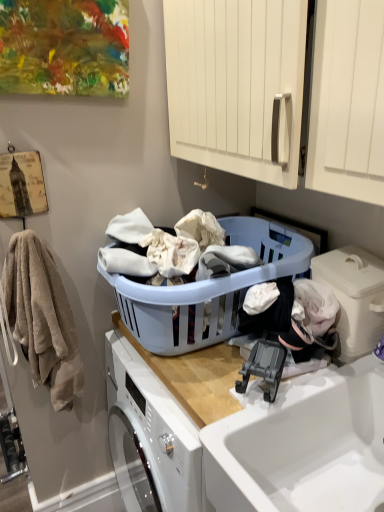
Question: From a real-world perspective, is white plastic container at lower right physically located above or below light blue plastic laundry basket at center?

Choices:
 (A) below
 (B) above

Answer: (B)

Question: Does point (354, 286) appear closer or farther from the camera than point (142, 312)?

Choices:
 (A) closer
 (B) farther

Answer: (A)

Question: Considering the real-world distances, which object is closest to the light blue plastic laundry basket at center?

Choices:
 (A) white glossy sink at lower right
 (B) beige soft towel at left
 (C) white plastic container at lower right

Answer: (C)

Question: Based on their relative distances, which object is nearer to the white glossy sink at lower right?

Choices:
 (A) light blue plastic laundry basket at center
 (B) white plastic container at lower right
 (C) beige soft towel at left

Answer: (B)